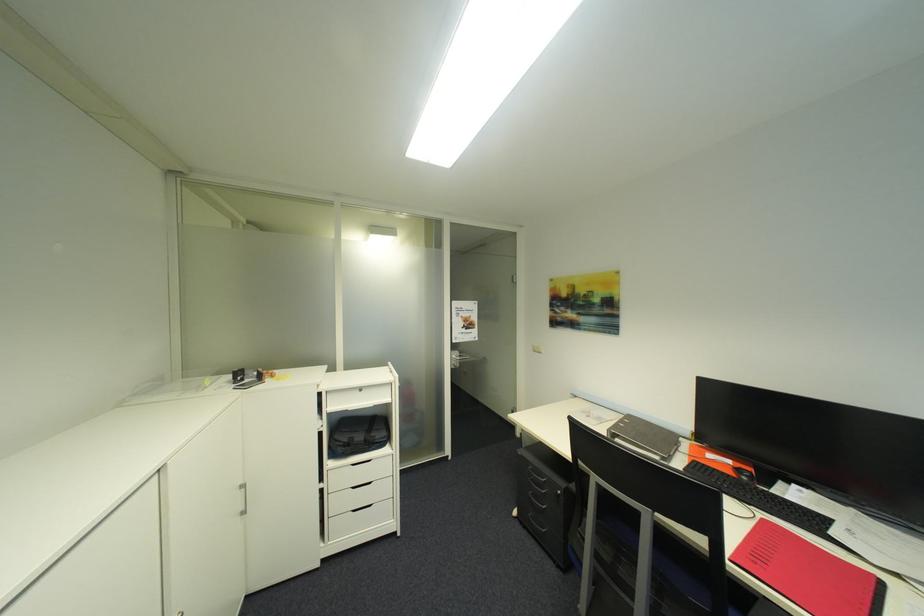
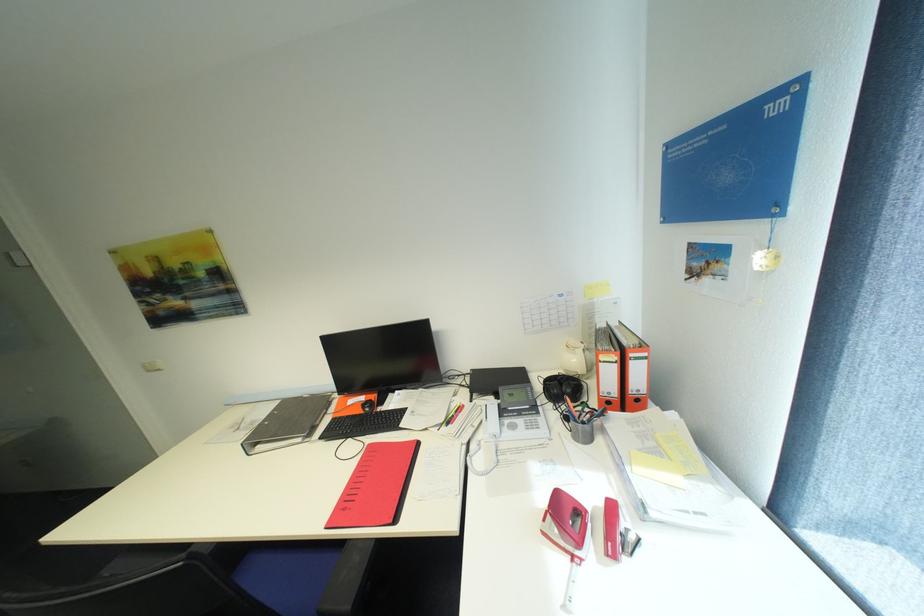
Based on the photo, the images are taken continuously from a first-person perspective. In which direction is your viewpoint rotating?

The camera rotated toward right-down.